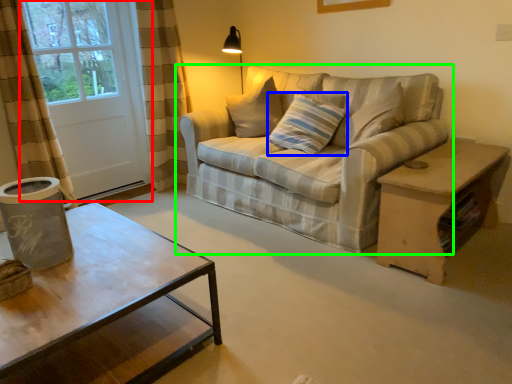
Question: Estimate the real-world distances between objects in this image. Which object is farther from screen door (highlighted by a red box), pillow (highlighted by a blue box) or studio couch (highlighted by a green box)?

Choices:
 (A) pillow
 (B) studio couch

Answer: (A)